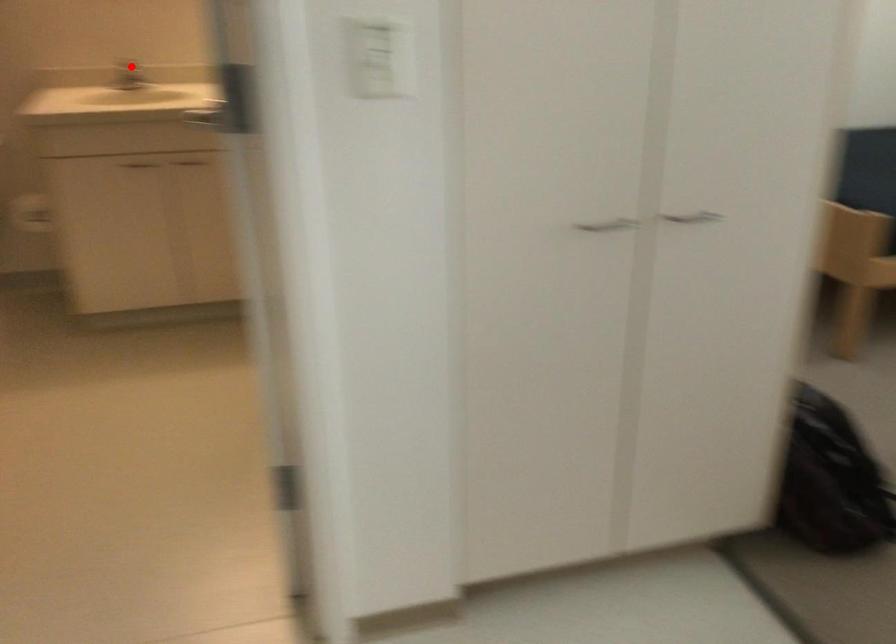
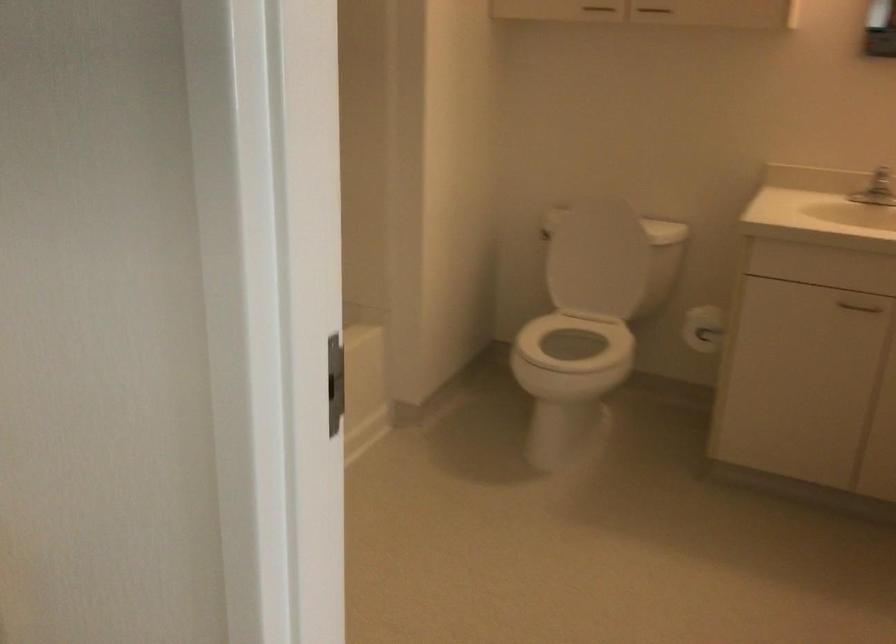
Locate, in the second image, the point that corresponds to the highlighted location in the first image.

(881, 182)